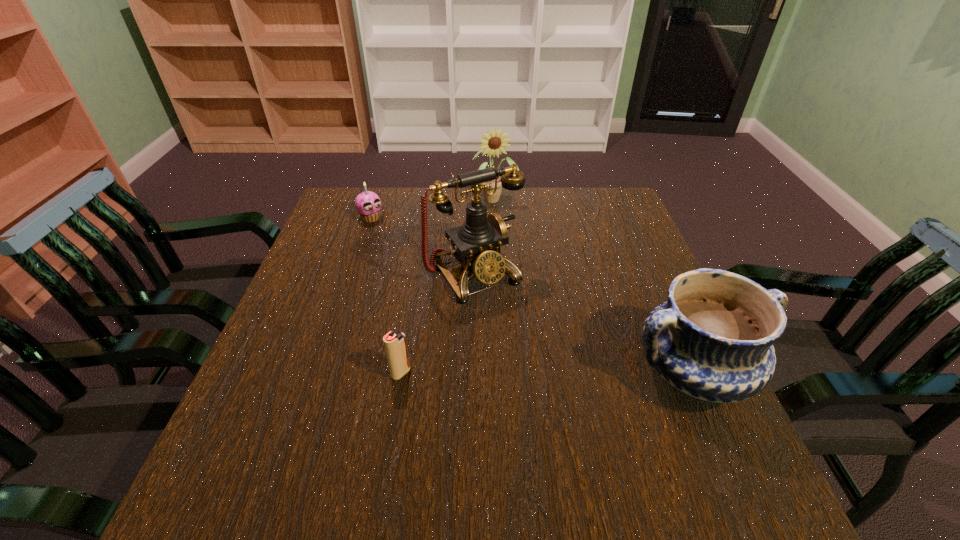
This screenshot has height=540, width=960. I want to click on free space at the right edge of the desktop, so click(x=610, y=254).

This screenshot has height=540, width=960. What are the coordinates of `vacant space at the far left corner of the desktop` in the screenshot? It's located at (337, 222).

This screenshot has height=540, width=960. I want to click on free space at the near left corner of the desktop, so click(281, 414).

The width and height of the screenshot is (960, 540). I want to click on free space at the far right corner, so click(604, 223).

I want to click on vacant space at the near right corner of the desktop, so click(x=707, y=449).

The width and height of the screenshot is (960, 540). I want to click on vacant region between the fourth object from right to left and the cupcake, so click(386, 295).

I want to click on free point between the leftmost object and the second tallest object, so click(x=433, y=208).

This screenshot has width=960, height=540. In order to click on free spot between the fourth object from right to left and the third nearest object in this screenshot , I will do `click(438, 324)`.

Where is `free space between the rightmost object and the tallest object`? free space between the rightmost object and the tallest object is located at coordinates (584, 324).

Image resolution: width=960 pixels, height=540 pixels. What are the coordinates of `vacant region between the igniter and the fourth nearest object` in the screenshot? It's located at (386, 295).